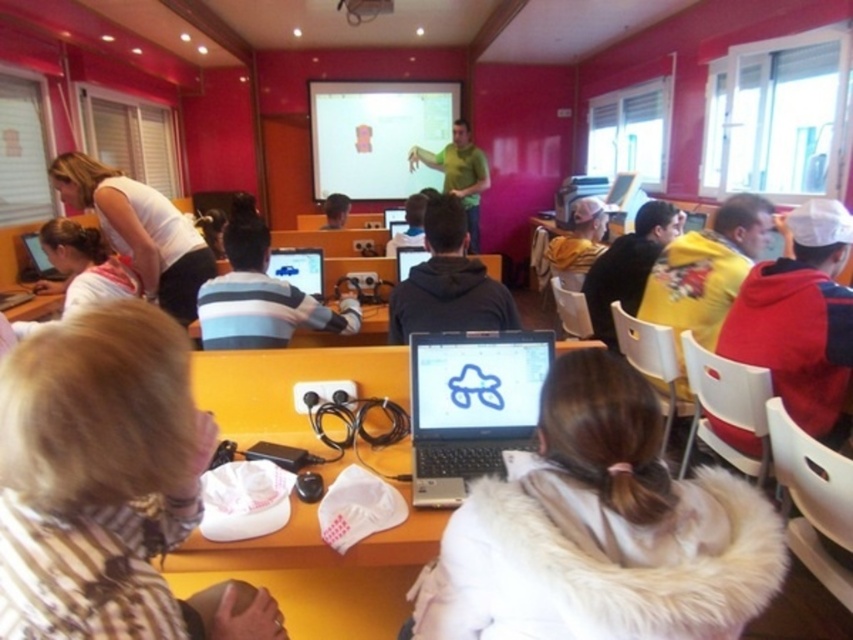
Question: In this image, where is white fabric at center located relative to green matte shirt at center?

Choices:
 (A) above
 (B) below

Answer: (B)

Question: Is matte black laptop at left smaller than black glossy laptop at center?

Choices:
 (A) no
 (B) yes

Answer: (A)

Question: Which of the following is the closest to the observer?

Choices:
 (A) silver/black laptop at center
 (B) smooth gray hoodie at center
 (C) yellow matte shirt at right
 (D) white fabric at center

Answer: (D)

Question: Can you confirm if yellow matte shirt at right is positioned to the left of black glossy laptop at center?

Choices:
 (A) yes
 (B) no

Answer: (B)

Question: Which point is closer to the camera?

Choices:
 (A) (457, 157)
 (B) (347, 204)
 (C) (282, 268)
 (D) (721, 304)

Answer: (D)

Question: Based on their relative distances, which object is nearer to the matte black laptop at left?

Choices:
 (A) silver/black laptop at center
 (B) black glossy laptop at center

Answer: (B)